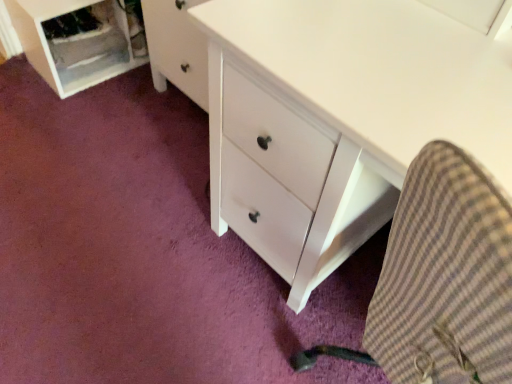
Locate an element on the screen. vacant space in front of white plastic file cabinet at lower left is located at coordinates (79, 105).